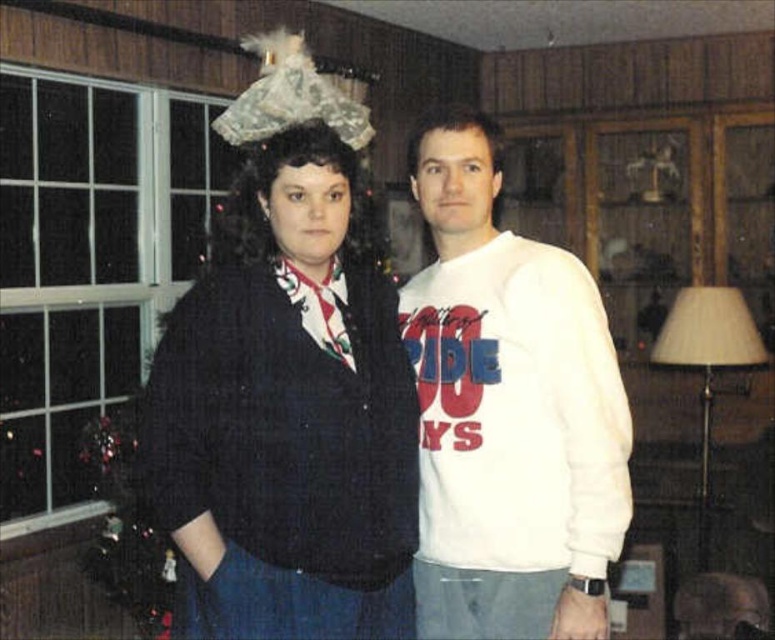
Is black knitted sweater at center above white cotton sweatshirt at center?

No, black knitted sweater at center is not above white cotton sweatshirt at center.

Between point (301, 268) and point (580, 428), which one is positioned in front?

Point (580, 428) is in front.

Locate an element on the screen. black knitted sweater at center is located at coordinates (286, 413).